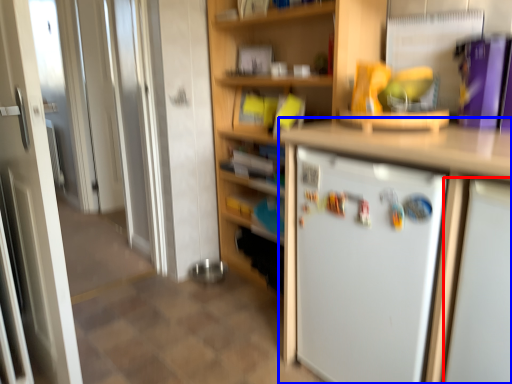
Question: Which object appears farthest to the camera in this image, appliance (highlighted by a red box) or cabinetry (highlighted by a blue box)?

Choices:
 (A) appliance
 (B) cabinetry

Answer: (B)